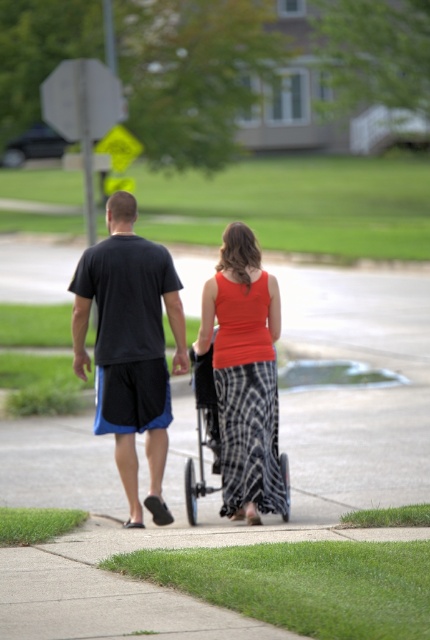
Is black fabric shorts at center positioned behind orange sleeveless top at center?

Yes.

Is point (116, 218) closer to viewer compared to point (270, 436)?

No.

Does point (147, 449) come farther from viewer compared to point (269, 330)?

No, it is not.

You are a GUI agent. You are given a task and a screenshot of the screen. Output one action in this format:
    pyautogui.click(x=<x>, y=<y>)
    Task: Click on the black fabric shorts at center
    The image size is (430, 640).
    Given the screenshot: What is the action you would take?
    pyautogui.click(x=129, y=346)